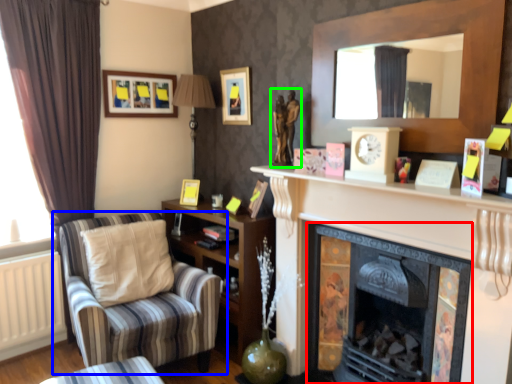
Question: Based on their relative distances, which object is farther from fireplace (highlighted by a red box)? Choose from chair (highlighted by a blue box) and sculpture (highlighted by a green box).

Choices:
 (A) chair
 (B) sculpture

Answer: (A)